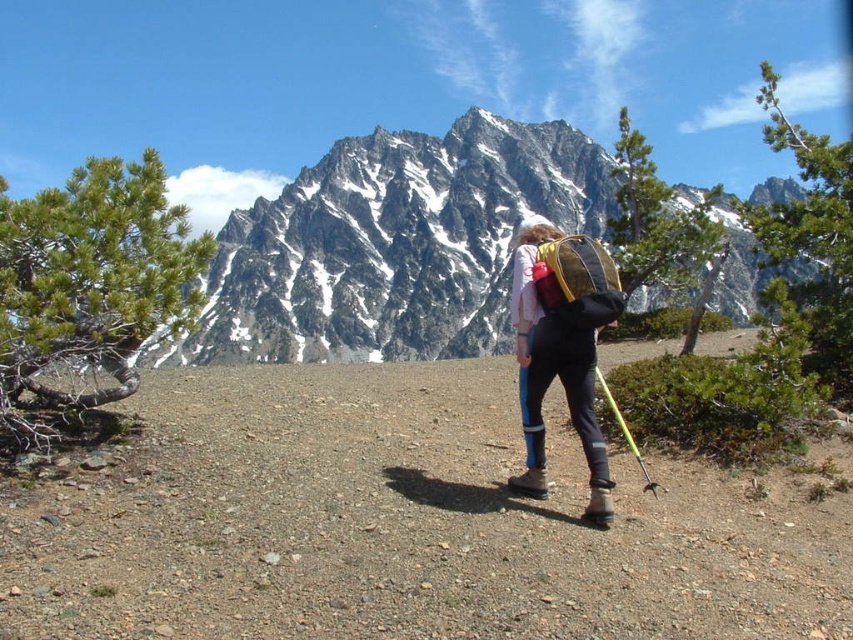
Question: Among these points, which one is farthest from the camera?

Choices:
 (A) (584, 136)
 (B) (596, 506)

Answer: (A)

Question: Can you confirm if snowy granite mountain at upper center is wider than matte black pants at center?

Choices:
 (A) no
 (B) yes

Answer: (B)

Question: Is snowy granite mountain at upper center to the right of matte black pants at center from the viewer's perspective?

Choices:
 (A) no
 (B) yes

Answer: (B)

Question: Among these objects, which one is nearest to the camera?

Choices:
 (A) snowy granite mountain at upper center
 (B) matte black pants at center

Answer: (B)

Question: Can you confirm if snowy granite mountain at upper center is thinner than matte black pants at center?

Choices:
 (A) yes
 (B) no

Answer: (B)

Question: Which point is closer to the camera?

Choices:
 (A) snowy granite mountain at upper center
 (B) matte black pants at center

Answer: (B)